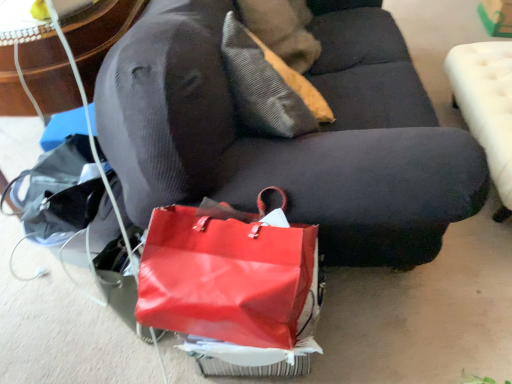
Describe the element at coordinates (487, 107) in the screenshot. I see `white tufted ottoman at right` at that location.

The width and height of the screenshot is (512, 384). Identify the location of textured beige pillow at upper center. (268, 87).

Locate an element on the screen. This screenshot has height=384, width=512. velvet dark gray couch at center is located at coordinates (290, 139).

The width and height of the screenshot is (512, 384). In order to click on pillow above the white tufted ottoman at right (from a real-world perspective) in this screenshot , I will do `click(268, 87)`.

Is white tufted ottoman at right far away from textured beige pillow at upper center?

No, white tufted ottoman at right is not far away from textured beige pillow at upper center.

Is white tufted ottoman at right facing away from textured beige pillow at upper center?

No, textured beige pillow at upper center is not at the back of white tufted ottoman at right.

From the image's perspective, is white tufted ottoman at right located above textured beige pillow at upper center?

No, from the image's perspective, white tufted ottoman at right is not over textured beige pillow at upper center.

From their relative heights in the image, would you say shiny red handbag at lower center is taller or shorter than white tufted ottoman at right?

shiny red handbag at lower center is shorter than white tufted ottoman at right.

Is white tufted ottoman at right at the back of shiny red handbag at lower center?

shiny red handbag at lower center is not turned away from white tufted ottoman at right.

Considering the positions of points (263, 279) and (507, 125), is point (263, 279) farther from camera compared to point (507, 125)?

No, (263, 279) is in front of (507, 125).

The image size is (512, 384). I want to click on furniture below the shiny red handbag at lower center (from a real-world perspective), so click(x=487, y=107).

Is velvet dark gray couch at center located within shiny red handbag at lower center?

No, velvet dark gray couch at center is located outside of shiny red handbag at lower center.

Is shiny red handbag at lower center taller than velvet dark gray couch at center?

No, shiny red handbag at lower center is not taller than velvet dark gray couch at center.

The image size is (512, 384). Find the location of `studio couch on the right of the shiny red handbag at lower center`. studio couch on the right of the shiny red handbag at lower center is located at coordinates (290, 139).

Would you say velvet dark gray couch at center is inside or outside textured beige pillow at upper center?

velvet dark gray couch at center is outside textured beige pillow at upper center.

Which is closer, [291,154] or [250,46]?

The point [291,154] is more forward.

The height and width of the screenshot is (384, 512). Identify the location of pillow lying behind the velvet dark gray couch at center. (268, 87).

Is velvet dark gray couch at center further to camera compared to textured beige pillow at upper center?

No, it is not.

Measure the distance between textured beige pillow at upper center and velvet dark gray couch at center.

textured beige pillow at upper center is 8.64 inches from velvet dark gray couch at center.

Would you consider textured beige pillow at upper center to be distant from velvet dark gray couch at center?

No.

Would you say textured beige pillow at upper center is inside or outside velvet dark gray couch at center?

textured beige pillow at upper center is enclosed within velvet dark gray couch at center.

The image size is (512, 384). What are the coordinates of `pillow behind the shiny red handbag at lower center` in the screenshot? It's located at (268, 87).

Between shiny red handbag at lower center and textured beige pillow at upper center, which one is positioned behind?

textured beige pillow at upper center is further away from the camera.

Is textured beige pillow at upper center located within shiny red handbag at lower center?

No.

Considering the relative sizes of shiny red handbag at lower center and textured beige pillow at upper center in the image provided, is shiny red handbag at lower center taller than textured beige pillow at upper center?

No.

Is velvet dark gray couch at center located outside shiny red handbag at lower center?

Indeed, velvet dark gray couch at center is completely outside shiny red handbag at lower center.

From the image's perspective, between velvet dark gray couch at center and shiny red handbag at lower center, who is located below?

shiny red handbag at lower center appears lower in the image.

Between velvet dark gray couch at center and shiny red handbag at lower center, which one has larger width?

Wider between the two is velvet dark gray couch at center.

How much distance is there between velvet dark gray couch at center and shiny red handbag at lower center?

velvet dark gray couch at center is 13.88 inches from shiny red handbag at lower center.

You are a GUI agent. You are given a task and a screenshot of the screen. Output one action in this format:
    pyautogui.click(x=<x>, y=<y>)
    Task: Click on the furniture that appears below the textured beige pillow at upper center (from the image's perspective)
    Image resolution: width=512 pixels, height=384 pixels.
    Given the screenshot: What is the action you would take?
    pyautogui.click(x=487, y=107)

Where is `furniture that is on the right side of shiny red handbag at lower center`? The height and width of the screenshot is (384, 512). furniture that is on the right side of shiny red handbag at lower center is located at coordinates (487, 107).

Which object lies further to the anchor point velvet dark gray couch at center, shiny red handbag at lower center or white tufted ottoman at right?

white tufted ottoman at right lies further to velvet dark gray couch at center than the other object.

Estimate the real-world distances between objects in this image. Which object is further from shiny red handbag at lower center, velvet dark gray couch at center or white tufted ottoman at right?

white tufted ottoman at right is further to shiny red handbag at lower center.

Looking at the image, which one is located further to textured beige pillow at upper center, shiny red handbag at lower center or velvet dark gray couch at center?

The object further to textured beige pillow at upper center is shiny red handbag at lower center.

Considering their positions, is textured beige pillow at upper center positioned further to shiny red handbag at lower center than white tufted ottoman at right?

white tufted ottoman at right lies further to shiny red handbag at lower center than the other object.

From the image, which object appears to be farther from white tufted ottoman at right, shiny red handbag at lower center or velvet dark gray couch at center?

shiny red handbag at lower center.

From the image, which object appears to be nearer to velvet dark gray couch at center, textured beige pillow at upper center or shiny red handbag at lower center?

Based on the image, textured beige pillow at upper center appears to be nearer to velvet dark gray couch at center.

Considering their positions, is shiny red handbag at lower center positioned closer to textured beige pillow at upper center than white tufted ottoman at right?

shiny red handbag at lower center is closer to textured beige pillow at upper center.

Consider the image. Considering their positions, is textured beige pillow at upper center positioned further to shiny red handbag at lower center than velvet dark gray couch at center?

textured beige pillow at upper center.

Locate an element on the screen. The height and width of the screenshot is (384, 512). pillow between shiny red handbag at lower center and white tufted ottoman at right is located at coordinates tap(268, 87).

Where is `studio couch between textured beige pillow at upper center and shiny red handbag at lower center vertically`? This screenshot has width=512, height=384. studio couch between textured beige pillow at upper center and shiny red handbag at lower center vertically is located at coordinates (290, 139).

Identify the location of studio couch situated between textured beige pillow at upper center and white tufted ottoman at right from left to right. (290, 139).

The width and height of the screenshot is (512, 384). What are the coordinates of `studio couch between shiny red handbag at lower center and white tufted ottoman at right` in the screenshot? It's located at (290, 139).